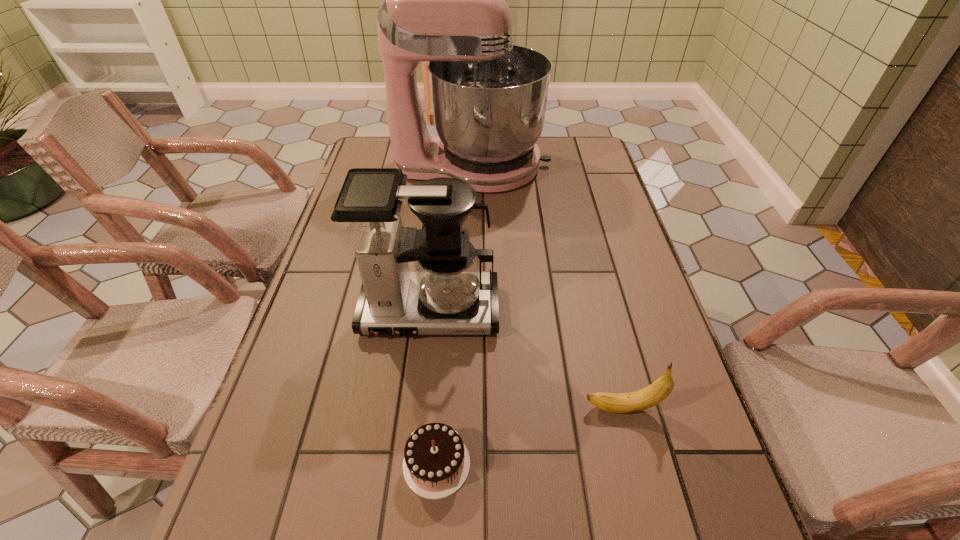
Locate an element on the screen. the farthest object is located at coordinates (443, 0).

Identify the location of mixer. (443, 0).

Locate an element on the screen. This screenshot has height=540, width=960. the second tallest object is located at coordinates (447, 294).

Where is `coffee maker`? The image size is (960, 540). coffee maker is located at coordinates (447, 294).

Locate an element on the screen. Image resolution: width=960 pixels, height=540 pixels. the third farthest object is located at coordinates (643, 399).

What are the coordinates of `banana` in the screenshot? It's located at (643, 399).

Identify the location of the nearest object. This screenshot has height=540, width=960. (436, 463).

This screenshot has width=960, height=540. Find the location of `the shortest object`. the shortest object is located at coordinates (436, 463).

Where is `free space located 0.050m on the front-facing side of the farthest object`? free space located 0.050m on the front-facing side of the farthest object is located at coordinates (565, 166).

In order to click on blank space located 0.300m at the front of the coffee maker where the controls are located in this screenshot , I will do `click(410, 494)`.